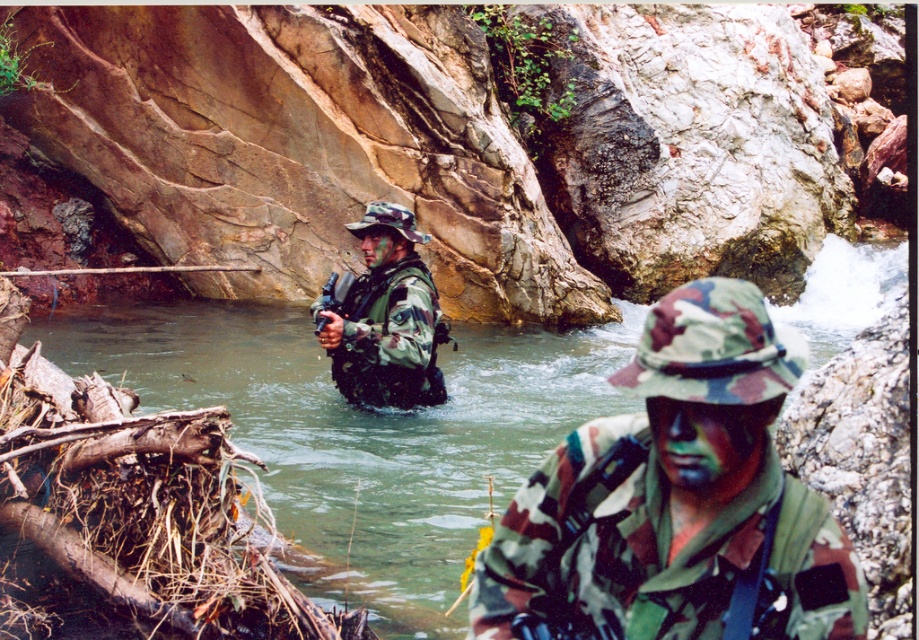
Image resolution: width=919 pixels, height=640 pixels. Describe the element at coordinates (676, 500) in the screenshot. I see `camo fabric uniform at center` at that location.

Is camo fabric uniform at center closer to camera compared to matte black rifle at center?

That is True.

The height and width of the screenshot is (640, 919). Identify the location of camo fabric uniform at center. (676, 500).

At what (x,y) coordinates should I click in order to perform the action: click on camo fabric uniform at center. Please return your answer as a coordinate pair (x, y). This screenshot has width=919, height=640. Looking at the image, I should click on (676, 500).

From the picture: Who is positioned more to the right, camo fabric uniform at center or greenish water at creek center?

greenish water at creek center is more to the right.

Is camo fabric uniform at center smaller than greenish water at creek center?

Yes.

This screenshot has height=640, width=919. What do you see at coordinates (676, 500) in the screenshot?
I see `camo fabric uniform at center` at bounding box center [676, 500].

Find the location of a particular element. camo fabric uniform at center is located at coordinates (676, 500).

Consider the image. Is camouflage fabric helmet at center shorter than matte black rifle at center?

No.

Is camouflage fabric helmet at center taller than matte black rifle at center?

Yes.

Identify the location of camouflage fabric helmet at center. This screenshot has width=919, height=640. (384, 317).

At what (x,y) coordinates should I click in order to perform the action: click on camouflage fabric helmet at center. Please return your answer as a coordinate pair (x, y). This screenshot has height=640, width=919. Looking at the image, I should click on (384, 317).